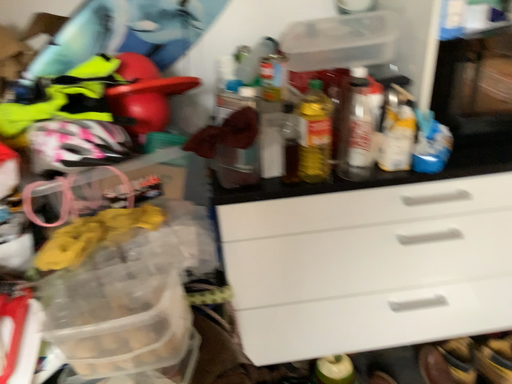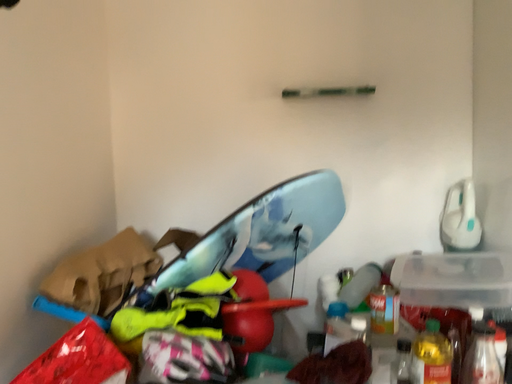
Question: How did the camera likely rotate when shooting the video?

Choices:
 (A) rotated downward
 (B) rotated upward

Answer: (B)